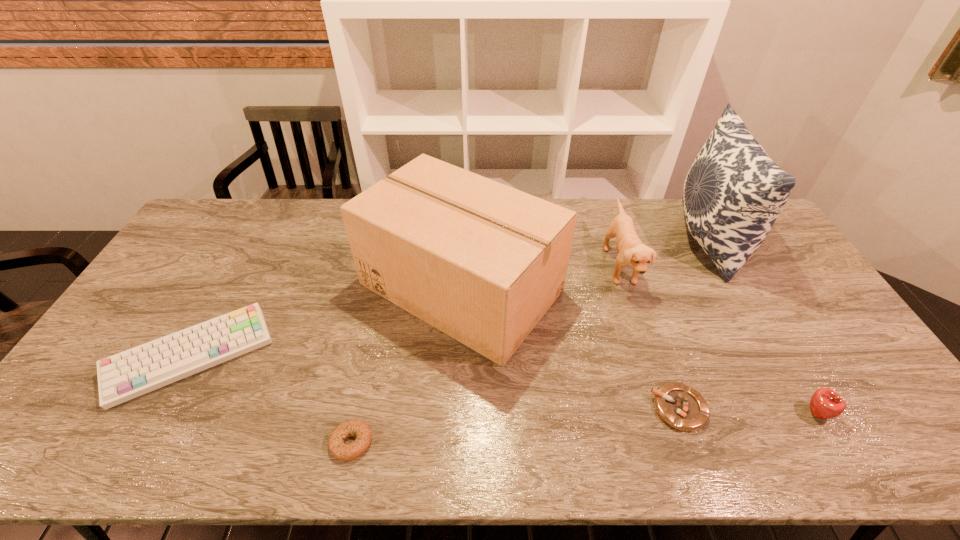
This screenshot has height=540, width=960. Find the location of `free point between the puppy and the apple`. free point between the puppy and the apple is located at coordinates (718, 339).

You are a GUI agent. You are given a task and a screenshot of the screen. Output one action in this format:
    pyautogui.click(x=<x>, y=<y>)
    Task: Click on the closest object relative to the third shortest object
    The height and width of the screenshot is (540, 960).
    Given the screenshot: What is the action you would take?
    pyautogui.click(x=482, y=262)

At what (x,y) coordinates should I click in order to perform the action: click on object that ranks as the fifth closest to the second tallest object. Please return your answer as a coordinate pair (x, y). The height and width of the screenshot is (540, 960). Looking at the image, I should click on (733, 193).

Find the location of a particular element. The width and height of the screenshot is (960, 540). vacant region that satisfies the following two spatial constraints: 1. on the front surface of the tallest object; 2. on the right side of the apple is located at coordinates (804, 413).

This screenshot has height=540, width=960. I want to click on blank space that satisfies the following two spatial constraints: 1. on the left side of the ashtray; 2. on the left side of the puppy, so click(666, 408).

This screenshot has height=540, width=960. Find the location of `blank space that satisfies the following two spatial constraints: 1. on the front side of the ashtray; 2. on the right side of the apple`. blank space that satisfies the following two spatial constraints: 1. on the front side of the ashtray; 2. on the right side of the apple is located at coordinates (681, 413).

Where is `free space that satisfies the following two spatial constraints: 1. on the front side of the apple; 2. on the left side of the leftmost object`? free space that satisfies the following two spatial constraints: 1. on the front side of the apple; 2. on the left side of the leftmost object is located at coordinates (160, 413).

Locate an element on the screen. The width and height of the screenshot is (960, 540). free location that satisfies the following two spatial constraints: 1. on the back side of the leftmost object; 2. on the left side of the box is located at coordinates (229, 287).